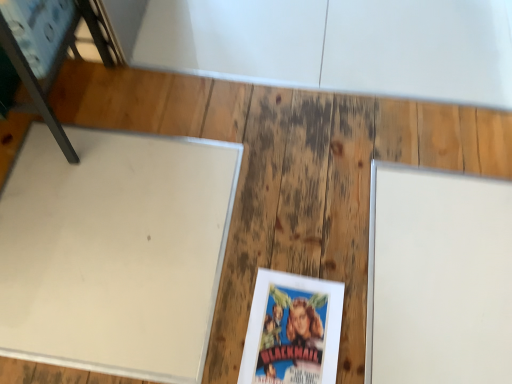
Question: From a real-world perspective, is white matte board at left located beneath metallic blue chair at upper left?

Choices:
 (A) no
 (B) yes

Answer: (B)

Question: Is white matte board at left thinner than metallic blue chair at upper left?

Choices:
 (A) no
 (B) yes

Answer: (A)

Question: Is white matte board at left bigger than metallic blue chair at upper left?

Choices:
 (A) no
 (B) yes

Answer: (A)

Question: Is white matte board at left turned away from metallic blue chair at upper left?

Choices:
 (A) yes
 (B) no

Answer: (B)

Question: Is white matte board at left positioned behind metallic blue chair at upper left?

Choices:
 (A) no
 (B) yes

Answer: (B)

Question: Considering the positions of point (183, 327) and point (459, 380), is point (183, 327) closer or farther from the camera than point (459, 380)?

Choices:
 (A) closer
 (B) farther

Answer: (B)

Question: From a real-world perspective, is white matte board at left positioned above or below white matte board at right?

Choices:
 (A) above
 (B) below

Answer: (B)

Question: Considering the relative positions of white matte board at left and white matte board at right in the image provided, is white matte board at left to the left or to the right of white matte board at right?

Choices:
 (A) left
 (B) right

Answer: (A)

Question: Considering the positions of white matte board at left and white matte board at right in the image, is white matte board at left wider or thinner than white matte board at right?

Choices:
 (A) thin
 (B) wide

Answer: (B)

Question: In terms of width, does white matte board at left look wider or thinner when compared to metallic blue chair at upper left?

Choices:
 (A) thin
 (B) wide

Answer: (B)

Question: From the image's perspective, is white matte board at left above or below metallic blue chair at upper left?

Choices:
 (A) below
 (B) above

Answer: (A)

Question: Based on their positions, is white matte board at left located to the left or right of metallic blue chair at upper left?

Choices:
 (A) right
 (B) left

Answer: (A)

Question: From a real-world perspective, relative to metallic blue chair at upper left, is white matte board at left vertically above or below?

Choices:
 (A) below
 (B) above

Answer: (A)

Question: Does point (309, 377) appear closer or farther from the camera than point (456, 248)?

Choices:
 (A) closer
 (B) farther

Answer: (A)

Question: Considering the positions of matte paper book at center and white matte board at right in the image, is matte paper book at center bigger or smaller than white matte board at right?

Choices:
 (A) small
 (B) big

Answer: (A)